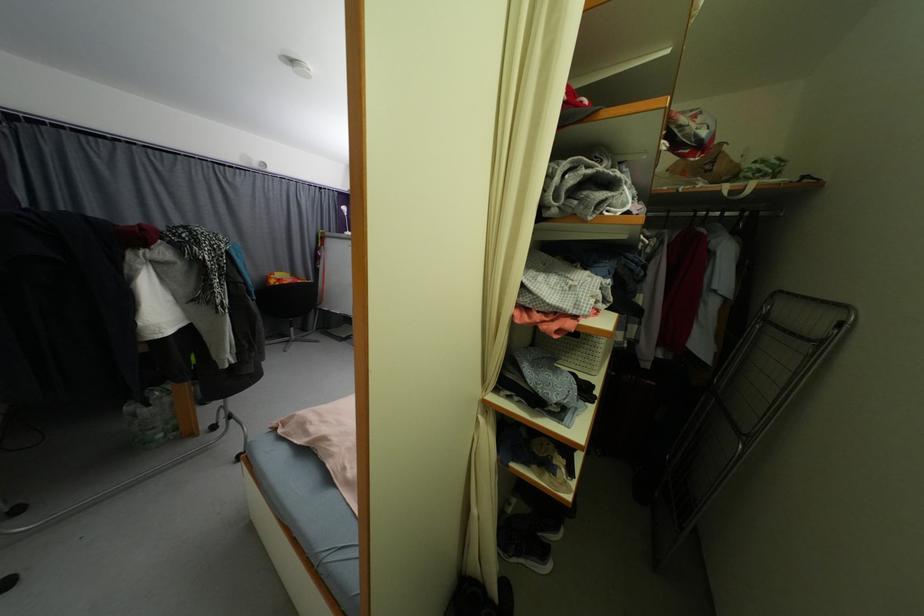
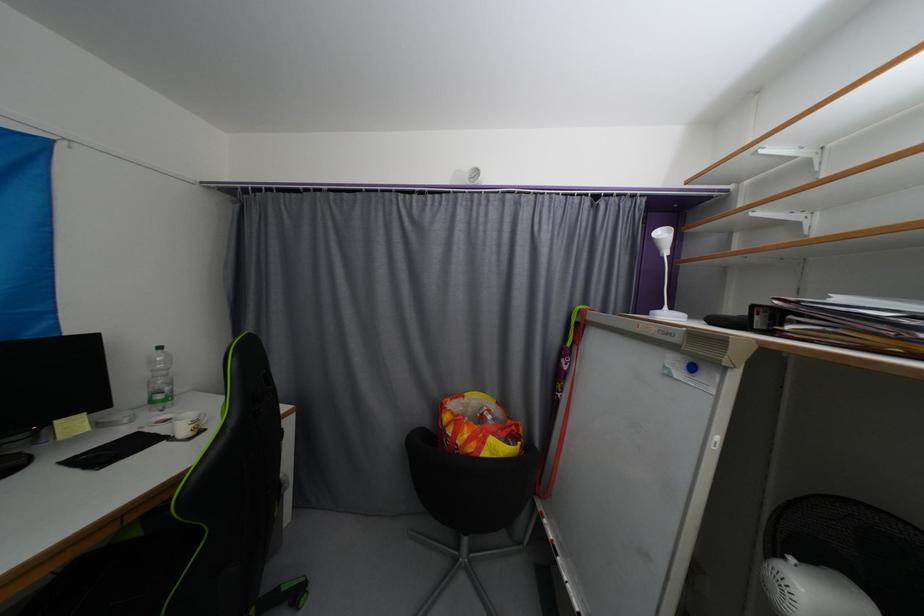
Find the pixel in the second image that matches [277,283] in the first image.

(452, 419)